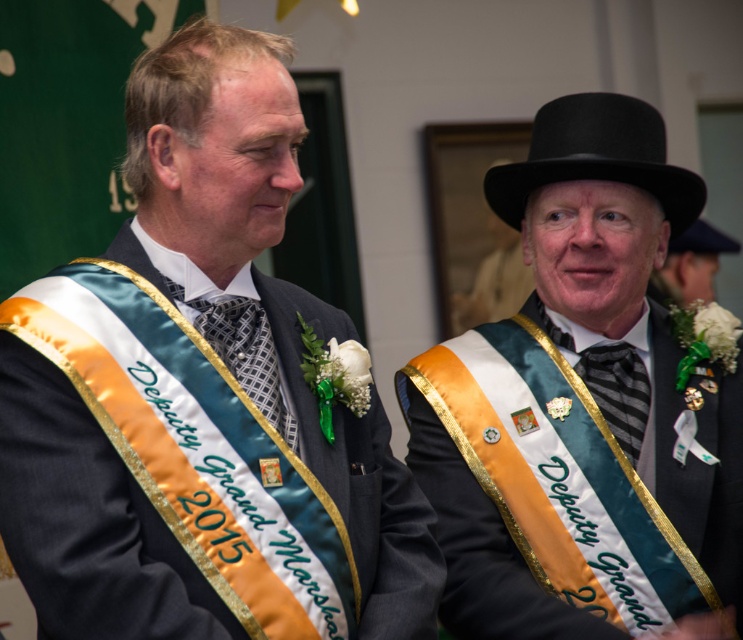
Question: Is matte black bowler hat at upper right to the left of black felt dress hat at upper right from the viewer's perspective?

Choices:
 (A) yes
 (B) no

Answer: (A)

Question: Which point is farther to the camera?

Choices:
 (A) black striped tie at center
 (B) matte black sash at left
 (C) matte black bowler hat at upper right
 (D) black felt dress hat at upper center

Answer: (D)

Question: Considering the relative positions of matte black bowler hat at upper right and black felt dress hat at upper right in the image provided, where is matte black bowler hat at upper right located with respect to black felt dress hat at upper right?

Choices:
 (A) left
 (B) right

Answer: (A)

Question: Which of these objects is positioned closest to the black striped tie at center?

Choices:
 (A) black felt dress hat at upper right
 (B) matte black sash at left
 (C) matte black hat at upper right
 (D) patterned silk tie at center

Answer: (A)

Question: Among these objects, which one is nearest to the camera?

Choices:
 (A) patterned silk tie at center
 (B) matte black sash at left
 (C) black felt dress hat at upper center

Answer: (B)

Question: Does patterned silk tie at center appear over black felt dress hat at upper center?

Choices:
 (A) no
 (B) yes

Answer: (A)